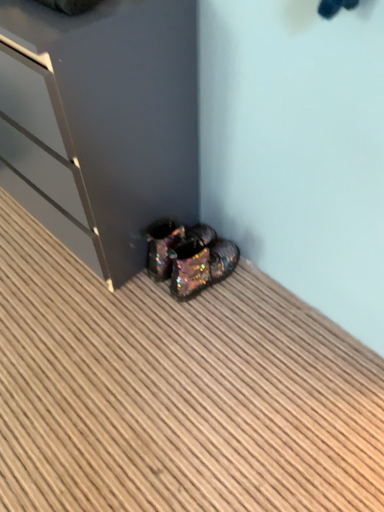
Based on the photo, what is the approximate width of glossy dark gray dresser at lower left?

glossy dark gray dresser at lower left is 16.72 inches in width.

What do you see at coordinates (101, 123) in the screenshot? I see `glossy dark gray dresser at lower left` at bounding box center [101, 123].

What do you see at coordinates (189, 256) in the screenshot? The image size is (384, 512). I see `iridescent glittery shoes at lower center` at bounding box center [189, 256].

Image resolution: width=384 pixels, height=512 pixels. Describe the element at coordinates (176, 392) in the screenshot. I see `iridescent metallic shoes at lower center` at that location.

The image size is (384, 512). I want to click on glossy dark gray dresser at lower left, so click(101, 123).

Visually, is iridescent glittery shoes at lower center positioned to the left or to the right of glossy dark gray dresser at lower left?

iridescent glittery shoes at lower center is positioned on glossy dark gray dresser at lower left's right side.

How much distance is there between iridescent glittery shoes at lower center and glossy dark gray dresser at lower left?

The distance of iridescent glittery shoes at lower center from glossy dark gray dresser at lower left is 26.18 centimeters.

Does iridescent glittery shoes at lower center have a greater width compared to glossy dark gray dresser at lower left?

No, iridescent glittery shoes at lower center is not wider than glossy dark gray dresser at lower left.

Looking at their sizes, would you say glossy dark gray dresser at lower left is wider or thinner than iridescent glittery shoes at lower center?

Considering their sizes, glossy dark gray dresser at lower left looks broader than iridescent glittery shoes at lower center.

Is glossy dark gray dresser at lower left beside iridescent glittery shoes at lower center?

There is a gap between glossy dark gray dresser at lower left and iridescent glittery shoes at lower center.

Choose the correct answer: Is glossy dark gray dresser at lower left inside iridescent glittery shoes at lower center or outside it?

glossy dark gray dresser at lower left lies outside iridescent glittery shoes at lower center.

Which of these two, iridescent metallic shoes at lower center or iridescent glittery shoes at lower center, is smaller?

With smaller size is iridescent glittery shoes at lower center.

Looking at this image, what's the angular difference between iridescent metallic shoes at lower center and iridescent glittery shoes at lower center's facing directions?

They differ by 179 degrees in their facing directions.

Could you tell me if iridescent metallic shoes at lower center is facing iridescent glittery shoes at lower center?

No, iridescent metallic shoes at lower center is not turned towards iridescent glittery shoes at lower center.

Are glossy dark gray dresser at lower left and iridescent metallic shoes at lower center making contact?

No, glossy dark gray dresser at lower left is not making contact with iridescent metallic shoes at lower center.

In the scene shown: Does glossy dark gray dresser at lower left have a larger size compared to iridescent metallic shoes at lower center?

Correct, glossy dark gray dresser at lower left is larger in size than iridescent metallic shoes at lower center.

Which is behind, glossy dark gray dresser at lower left or iridescent metallic shoes at lower center?

glossy dark gray dresser at lower left.

Is glossy dark gray dresser at lower left looking in the opposite direction of iridescent metallic shoes at lower center?

No.

From a real-world perspective, is iridescent metallic shoes at lower center positioned over glossy dark gray dresser at lower left based on gravity?

Incorrect, from a real-world perspective, iridescent metallic shoes at lower center is lower than glossy dark gray dresser at lower left.

Which object is positioned more to the left, iridescent metallic shoes at lower center or glossy dark gray dresser at lower left?

Positioned to the left is glossy dark gray dresser at lower left.

The image size is (384, 512). Find the location of `hardwood below the glossy dark gray dresser at lower left (from a real-world perspective)`. hardwood below the glossy dark gray dresser at lower left (from a real-world perspective) is located at coordinates (176, 392).

From the image's perspective, which one is positioned lower, iridescent glittery shoes at lower center or iridescent metallic shoes at lower center?

iridescent metallic shoes at lower center, from the image's perspective.

Who is taller, iridescent glittery shoes at lower center or iridescent metallic shoes at lower center?

With more height is iridescent glittery shoes at lower center.

From a real-world perspective, is iridescent glittery shoes at lower center located beneath iridescent metallic shoes at lower center?

No.

Where is `footwear below the glossy dark gray dresser at lower left (from the image's perspective)`? This screenshot has height=512, width=384. footwear below the glossy dark gray dresser at lower left (from the image's perspective) is located at coordinates (189, 256).

You are a GUI agent. You are given a task and a screenshot of the screen. Output one action in this format:
    pyautogui.click(x=<x>, y=<y>)
    Task: Click on the footwear behind the glossy dark gray dresser at lower left
    The height and width of the screenshot is (512, 384).
    Given the screenshot: What is the action you would take?
    pyautogui.click(x=189, y=256)

Which object lies further to the anchor point iridescent metallic shoes at lower center, glossy dark gray dresser at lower left or iridescent glittery shoes at lower center?

Among the two, glossy dark gray dresser at lower left is located further to iridescent metallic shoes at lower center.

Looking at the image, which one is located closer to iridescent metallic shoes at lower center, iridescent glittery shoes at lower center or glossy dark gray dresser at lower left?

Based on the image, iridescent glittery shoes at lower center appears to be nearer to iridescent metallic shoes at lower center.

In the scene shown: Based on their spatial positions, is glossy dark gray dresser at lower left or iridescent metallic shoes at lower center closer to iridescent glittery shoes at lower center?

glossy dark gray dresser at lower left is closer to iridescent glittery shoes at lower center.

Estimate the real-world distances between objects in this image. Which object is further from glossy dark gray dresser at lower left, iridescent glittery shoes at lower center or iridescent metallic shoes at lower center?

Based on the image, iridescent metallic shoes at lower center appears to be further to glossy dark gray dresser at lower left.

From the image, which object appears to be farther from glossy dark gray dresser at lower left, iridescent metallic shoes at lower center or iridescent glittery shoes at lower center?

Among the two, iridescent metallic shoes at lower center is located further to glossy dark gray dresser at lower left.

When comparing their distances from iridescent glittery shoes at lower center, does iridescent metallic shoes at lower center or glossy dark gray dresser at lower left seem further?

iridescent metallic shoes at lower center.

The image size is (384, 512). What are the coordinates of `footwear between glossy dark gray dresser at lower left and iridescent metallic shoes at lower center in the vertical direction` in the screenshot? It's located at (189, 256).